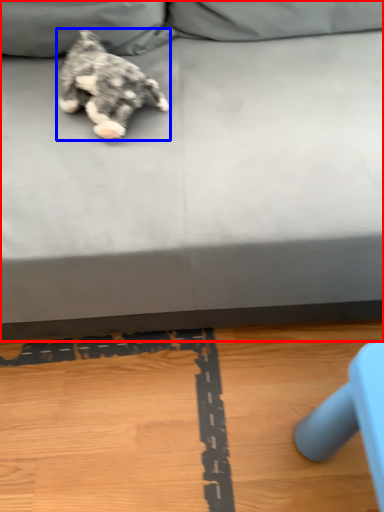
Question: Which of the following is the farthest to the observer, studio couch (highlighted by a red box) or dog (highlighted by a blue box)?

Choices:
 (A) studio couch
 (B) dog

Answer: (B)